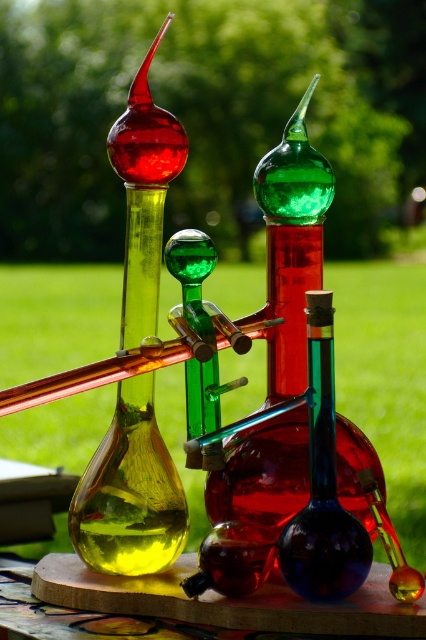
Is point (218, 480) farther from camera compared to point (170, 502)?

Yes, it is.

Who is positioned more to the right, green glass bottle at center or matte glass bottle at left?

From the viewer's perspective, green glass bottle at center appears more on the right side.

Locate an element on the screen. green glass bottle at center is located at coordinates (288, 417).

Which of these two, matte glass bottle at left or blue glass bottle at center, stands shorter?

blue glass bottle at center

Who is positioned more to the left, matte glass bottle at left or blue glass bottle at center?

matte glass bottle at left is more to the left.

Describe the element at coordinates (129, 492) in the screenshot. I see `matte glass bottle at left` at that location.

You are a GUI agent. You are given a task and a screenshot of the screen. Output one action in this format:
    pyautogui.click(x=<x>, y=<y>)
    Task: Click on the matte glass bottle at left
    
    Given the screenshot: What is the action you would take?
    pyautogui.click(x=129, y=492)

Measure the distance between green glass bottle at center and blue glass bottle at center.

0.80 inches

Is green glass bottle at center wider than blue glass bottle at center?

Yes.

Identify the location of green glass bottle at center. (288, 417).